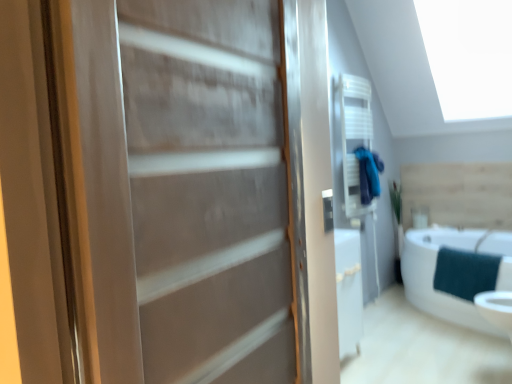
Question: Is white glossy bathtub at lower right positioned beyond the bounds of matte wood door at center?

Choices:
 (A) yes
 (B) no

Answer: (A)

Question: Does white glossy bathtub at lower right have a greater height compared to matte wood door at center?

Choices:
 (A) no
 (B) yes

Answer: (A)

Question: From a real-world perspective, does white glossy bathtub at lower right sit lower than matte wood door at center?

Choices:
 (A) no
 (B) yes

Answer: (B)

Question: From a real-world perspective, is white glossy bathtub at lower right on top of matte wood door at center?

Choices:
 (A) no
 (B) yes

Answer: (A)

Question: Can you confirm if white glossy bathtub at lower right is shorter than matte wood door at center?

Choices:
 (A) no
 (B) yes

Answer: (B)

Question: Is white glossy bathtub at lower right positioned with its back to matte wood door at center?

Choices:
 (A) no
 (B) yes

Answer: (A)

Question: Is matte wood door at center surrounding teal fabric bathrobe at upper right?

Choices:
 (A) yes
 (B) no

Answer: (B)

Question: Considering the relative positions of matte wood door at center and teal fabric bathrobe at upper right in the image provided, is matte wood door at center to the right of teal fabric bathrobe at upper right from the viewer's perspective?

Choices:
 (A) yes
 (B) no

Answer: (B)

Question: From the image's perspective, would you say matte wood door at center is shown under teal fabric bathrobe at upper right?

Choices:
 (A) yes
 (B) no

Answer: (A)

Question: From the image's perspective, is matte wood door at center on teal fabric bathrobe at upper right?

Choices:
 (A) yes
 (B) no

Answer: (B)

Question: Is the depth of matte wood door at center less than that of teal fabric bathrobe at upper right?

Choices:
 (A) yes
 (B) no

Answer: (A)

Question: Considering the relative sizes of matte wood door at center and teal fabric bathrobe at upper right in the image provided, is matte wood door at center smaller than teal fabric bathrobe at upper right?

Choices:
 (A) no
 (B) yes

Answer: (A)

Question: Is teal fabric bathrobe at upper right behind teal fabric towel at lower right?

Choices:
 (A) no
 (B) yes

Answer: (B)